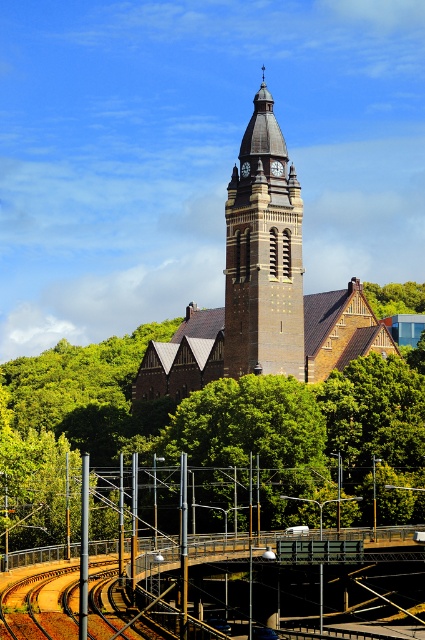
You are standing in front of the church and want to take a photo that includes both the green leafy tree at center and the brown stone clock tower at center. Which object will appear bigger in the photo?

The green leafy tree at center will appear bigger in the photo because it has a larger size compared to the brown stone clock tower at center.

You are a drone operator planning to fly a drone between the brown stone clock tower at center and the green leafy tree at upper center. The drone has a maximum flight distance of 30 meters. Can the drone safely fly between these two points without exceeding its range?

The brown stone clock tower at center and green leafy tree at upper center are 32.76 meters apart from each other, which exceeds the drone maximum flight distance of 30 meters. Therefore, the drone cannot safely fly between them without exceeding its range.